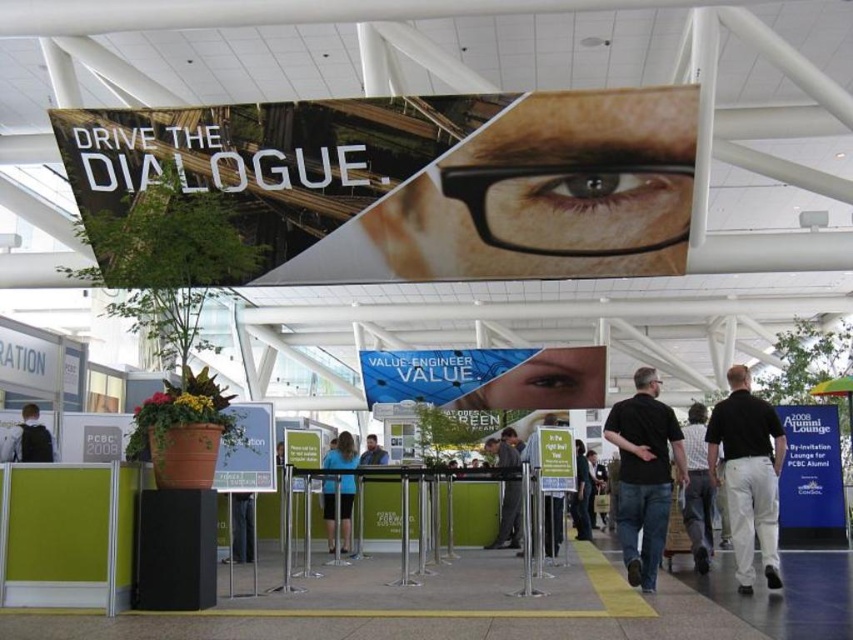
Is blue glossy eye at upper center further to camera compared to plaid shirt at center?

Yes.

Which is behind, point (607, 188) or point (709, 540)?

The point (607, 188) is behind.

Is point (572, 192) positioned in front of point (688, 460)?

No.

Find the location of a particular element. This screenshot has width=853, height=640. blue glossy eye at upper center is located at coordinates (599, 189).

From the picture: Between blue fabric shirt at center and matte black shirt at center, which one is positioned lower?

matte black shirt at center

Who is positioned more to the right, blue fabric shirt at center or matte black shirt at center?

Positioned to the right is blue fabric shirt at center.

Between point (341, 541) and point (372, 460), which one is positioned in front?

Point (341, 541) is in front.

Image resolution: width=853 pixels, height=640 pixels. What are the coordinates of `blue fabric shirt at center` in the screenshot? It's located at (341, 452).

Based on the photo, is dark gray jacket at lower left below brown matte eye at upper center?

No, dark gray jacket at lower left is not below brown matte eye at upper center.

Who is more distant from viewer, (28, 403) or (553, 387)?

The point (553, 387) is behind.

Which is behind, point (15, 454) or point (537, 380)?

The point (537, 380) is more distant.

Locate an element on the screen. This screenshot has height=640, width=853. dark gray jacket at lower left is located at coordinates (32, 438).